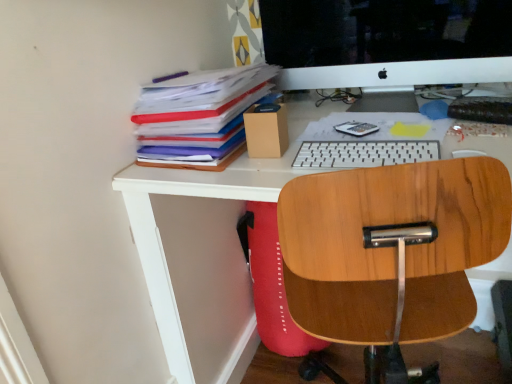
The width and height of the screenshot is (512, 384). I want to click on white glossy computer monitor at upper center, so click(x=387, y=41).

Image resolution: width=512 pixels, height=384 pixels. I want to click on white plastic keyboard at center, so click(362, 153).

What is the approximate width of wooden office chair at center?

wooden office chair at center is 19.64 inches wide.

This screenshot has height=384, width=512. What are the coordinates of `multicolored paper at upper left` in the screenshot? It's located at (199, 117).

Is wooden office chair at center inside or outside of white glossy computer monitor at upper center?

wooden office chair at center cannot be found inside white glossy computer monitor at upper center.

Is wooden office chair at center behind white glossy computer monitor at upper center?

That is False.

Measure the distance from wooden office chair at center to white glossy computer monitor at upper center.

They are 23.01 inches apart.

Is wooden office chair at center not near white glossy computer monitor at upper center?

No, wooden office chair at center is in close proximity to white glossy computer monitor at upper center.

This screenshot has height=384, width=512. I want to click on paperback book below the white glossy computer monitor at upper center (from a real-world perspective), so click(x=199, y=117).

From the image's perspective, does multicolored paper at upper left appear higher than white glossy computer monitor at upper center?

Incorrect, from the image's perspective, multicolored paper at upper left is lower than white glossy computer monitor at upper center.

Are multicolored paper at upper left and white glossy computer monitor at upper center located far from each other?

No, multicolored paper at upper left is not far away from white glossy computer monitor at upper center.

From the image's perspective, is multicolored paper at upper left beneath white plastic keyboard at center?

No.

Considering the sizes of objects multicolored paper at upper left and white plastic keyboard at center in the image provided, who is thinner, multicolored paper at upper left or white plastic keyboard at center?

white plastic keyboard at center is thinner.

Considering the relative sizes of multicolored paper at upper left and white plastic keyboard at center in the image provided, is multicolored paper at upper left taller than white plastic keyboard at center?

Yes, multicolored paper at upper left is taller than white plastic keyboard at center.

Considering the sizes of multicolored paper at upper left and white plastic keyboard at center in the image, is multicolored paper at upper left bigger or smaller than white plastic keyboard at center?

Clearly, multicolored paper at upper left is larger in size than white plastic keyboard at center.

Between white plastic keyboard at center and multicolored paper at upper left, which one appears on the right side from the viewer's perspective?

white plastic keyboard at center is more to the right.

Where is `paperback book above the white plastic keyboard at center (from the image's perspective)`? This screenshot has height=384, width=512. paperback book above the white plastic keyboard at center (from the image's perspective) is located at coordinates (199, 117).

From the image's perspective, is white plastic keyboard at center positioned above or below multicolored paper at upper left?

white plastic keyboard at center is situated lower than multicolored paper at upper left in the image.

Which is nearer, (371, 316) or (307, 150)?

Point (371, 316) is positioned closer to the camera compared to point (307, 150).

Can you tell me how much wooden office chair at center and white plastic keyboard at center differ in facing direction?

165 degrees separate the facing orientations of wooden office chair at center and white plastic keyboard at center.

Is wooden office chair at center facing towards white plastic keyboard at center?

No, wooden office chair at center is not oriented towards white plastic keyboard at center.

Is wooden office chair at center not near white plastic keyboard at center?

wooden office chair at center is actually quite close to white plastic keyboard at center.

Is white plastic keyboard at center in contact with white glossy computer monitor at upper center?

No, white plastic keyboard at center is not touching white glossy computer monitor at upper center.

Is white plastic keyboard at center looking in the opposite direction of white glossy computer monitor at upper center?

Yes, white plastic keyboard at center's orientation is away from white glossy computer monitor at upper center.

Is white plastic keyboard at center bigger than white glossy computer monitor at upper center?

No, white plastic keyboard at center is not bigger than white glossy computer monitor at upper center.

Does point (426, 224) come behind point (147, 144)?

No, it is in front of (147, 144).

Based on the photo, which object is further away from the camera, wooden office chair at center or multicolored paper at upper left?

multicolored paper at upper left is more distant.

From a real-world perspective, is wooden office chair at center located higher than multicolored paper at upper left?

No, from a real-world perspective, wooden office chair at center is not above multicolored paper at upper left.

Find the location of a particular element. The height and width of the screenshot is (384, 512). chair in front of the multicolored paper at upper left is located at coordinates (391, 249).

The image size is (512, 384). I want to click on chair located underneath the white glossy computer monitor at upper center (from a real-world perspective), so click(391, 249).

Identify the location of computer monitor behind the multicolored paper at upper left. [x=387, y=41].

From the image, which object appears to be nearer to white plastic keyboard at center, wooden office chair at center or white glossy computer monitor at upper center?

wooden office chair at center is positioned closer to the anchor white plastic keyboard at center.

From the image, which object appears to be farther from white plastic keyboard at center, multicolored paper at upper left or white glossy computer monitor at upper center?

white glossy computer monitor at upper center is further to white plastic keyboard at center.

When comparing their distances from white plastic keyboard at center, does multicolored paper at upper left or wooden office chair at center seem further?

The object further to white plastic keyboard at center is multicolored paper at upper left.

Considering their positions, is white plastic keyboard at center positioned further to multicolored paper at upper left than wooden office chair at center?

Among the two, wooden office chair at center is located further to multicolored paper at upper left.

Looking at the image, which one is located further to wooden office chair at center, white plastic keyboard at center or multicolored paper at upper left?

multicolored paper at upper left.

When comparing their distances from multicolored paper at upper left, does wooden office chair at center or white plastic keyboard at center seem closer?

white plastic keyboard at center is positioned closer to the anchor multicolored paper at upper left.

Looking at the image, which one is located closer to white glossy computer monitor at upper center, white plastic keyboard at center or multicolored paper at upper left?

multicolored paper at upper left is closer to white glossy computer monitor at upper center.

When comparing their distances from wooden office chair at center, does white glossy computer monitor at upper center or white plastic keyboard at center seem further?

Among the two, white glossy computer monitor at upper center is located further to wooden office chair at center.

Locate an element on the screen. The image size is (512, 384). keyboard that lies between white glossy computer monitor at upper center and wooden office chair at center from top to bottom is located at coordinates (362, 153).

The height and width of the screenshot is (384, 512). I want to click on paperback book between white glossy computer monitor at upper center and wooden office chair at center in the up-down direction, so click(199, 117).

Find the location of a particular element. keyboard between multicolored paper at upper left and wooden office chair at center in the up-down direction is located at coordinates (362, 153).

Locate an element on the screen. This screenshot has height=384, width=512. keyboard between multicolored paper at upper left and white glossy computer monitor at upper center is located at coordinates (362, 153).